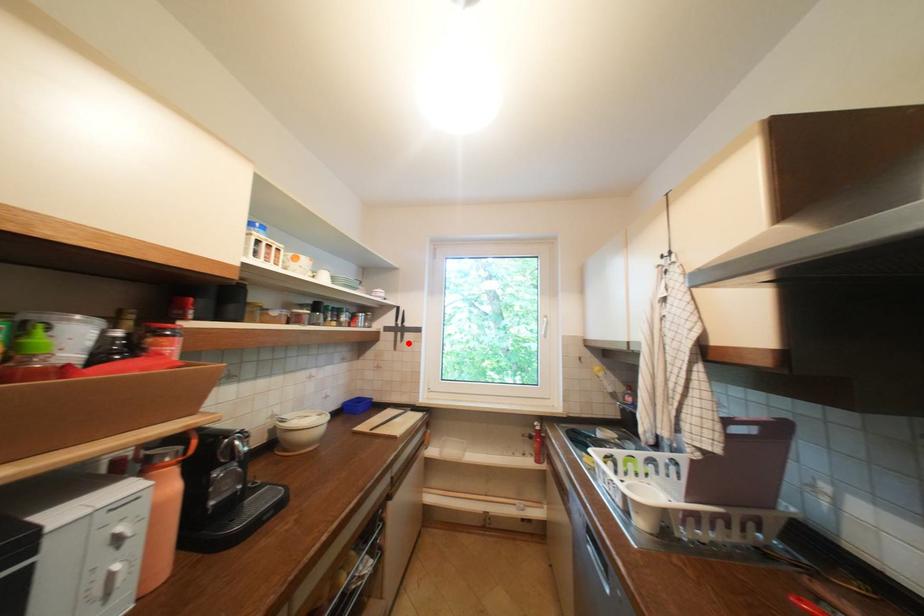
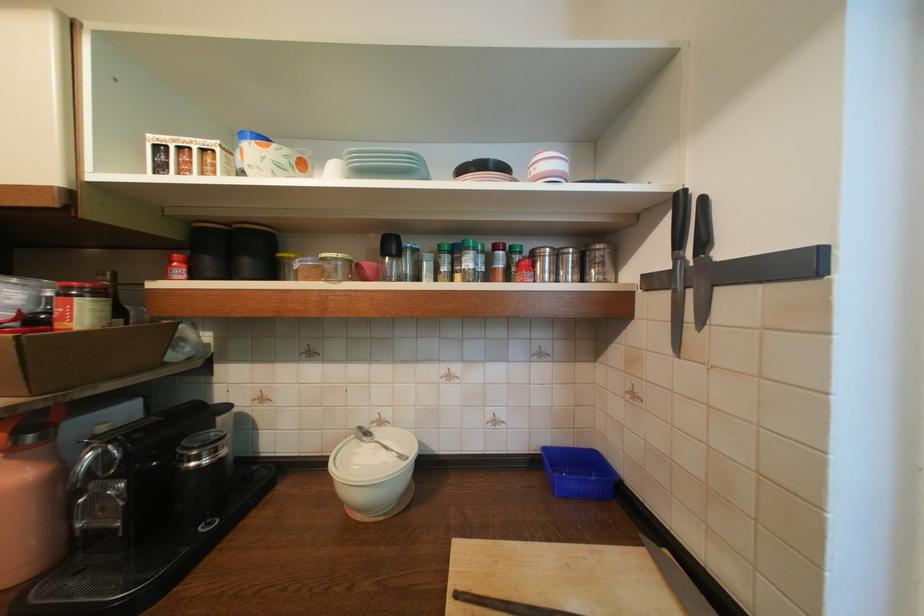
Locate, in the second image, the point that corresponds to the highlighted location in the first image.

(701, 326)